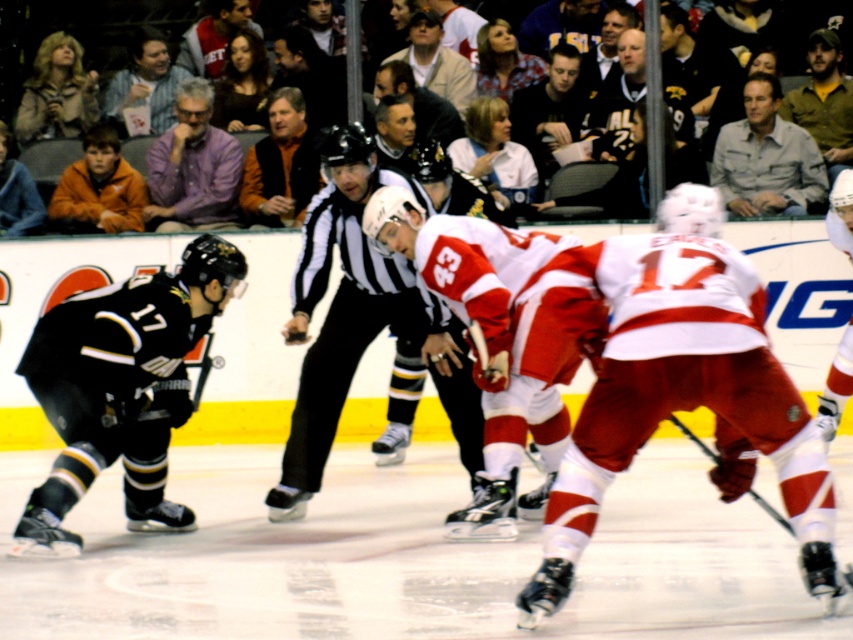
You are a photographer positioned at the edge of the ice rink. You need to capture a photo of both the red matte jersey at center and the striped shirt at upper center. Based on their sizes in the image, which object should you focus on first to ensure both are in frame?

The red matte jersey at center is wider than the striped shirt at upper center. To ensure both are in frame, focus on the wider object first, which is the red matte jersey at center.

You are a spectator at the ice hockey game. You notice the red matte jersey at center and the striped shirt at upper center. Which of these two items is positioned to the right side of the other?

The red matte jersey at center is to the right of the striped shirt at upper center.